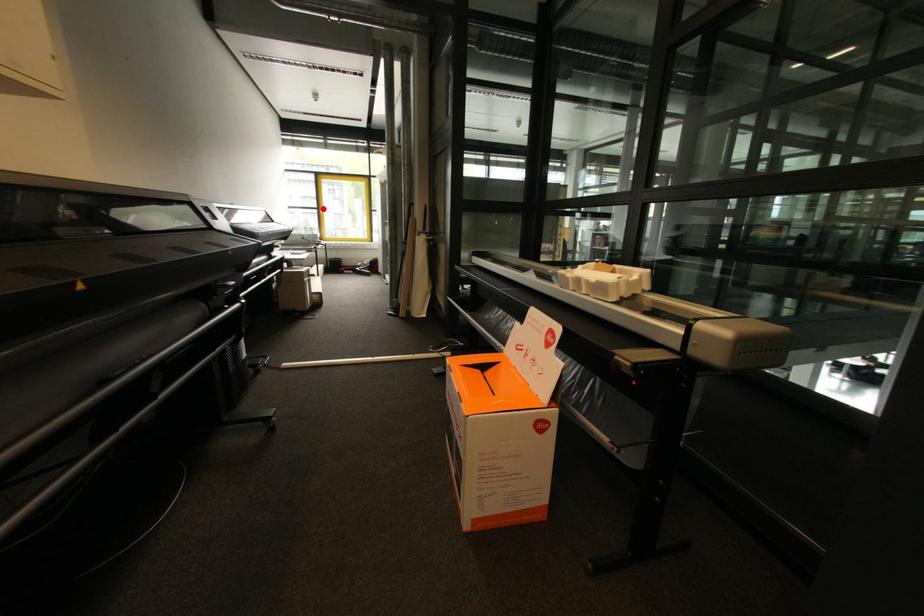
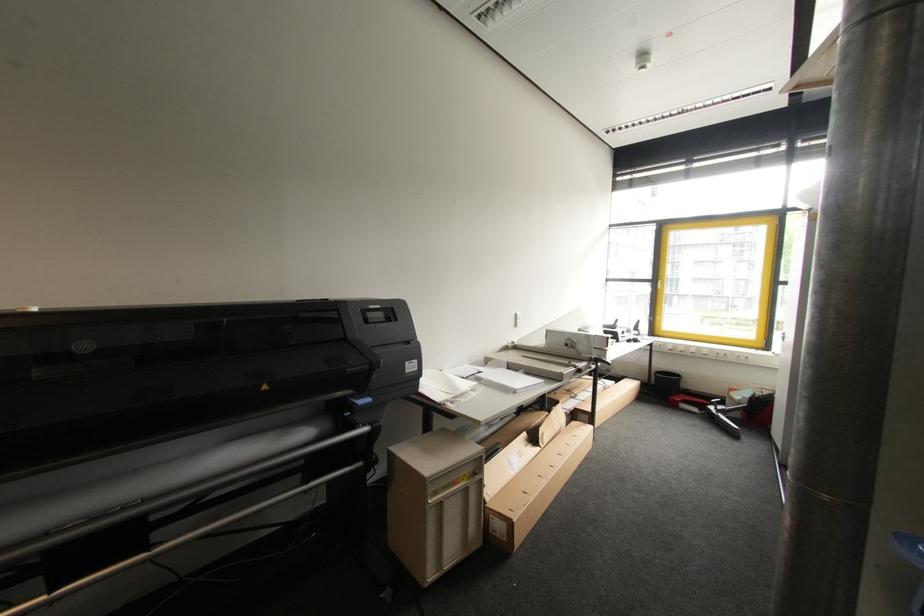
Locate, in the second image, the point that corresponds to the highlighted location in the first image.

(660, 281)